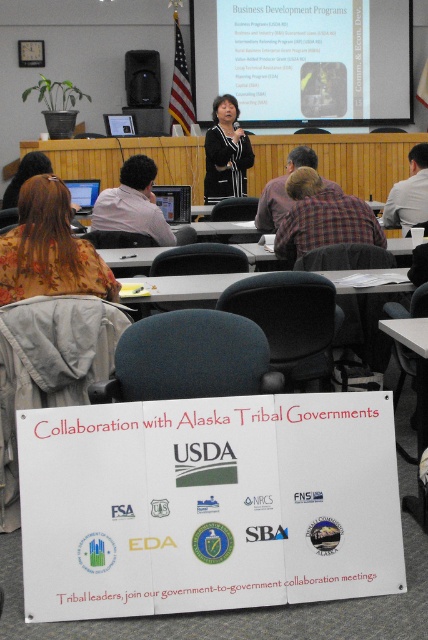
Consider the image. What is located at the coordinates point (50, 248) in the image?

The floral fabric shirt at lower left is located at point (50, 248).

You are an attendee at the meeting and need to locate the speaker. Which object is closer to the front of the room, the floral fabric shirt at lower left or the matte black speaker at upper center?

The floral fabric shirt at lower left is positioned on the right side of the matte black speaker at upper center, so the matte black speaker at upper center is closer to the front of the room.

You are attending a presentation and notice two people wearing shirts with distinct patterns. The floral fabric shirt at lower left and the plaid fabric shirt at center. From your perspective at the front of the room, which shirt is positioned further to the left?

The floral fabric shirt at lower left is positioned further to the left compared to the plaid fabric shirt at center.